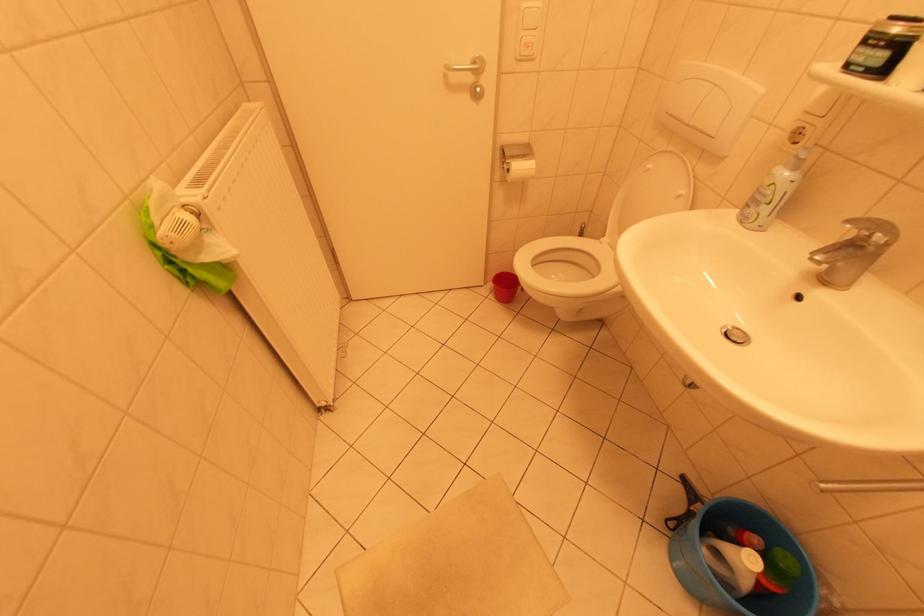
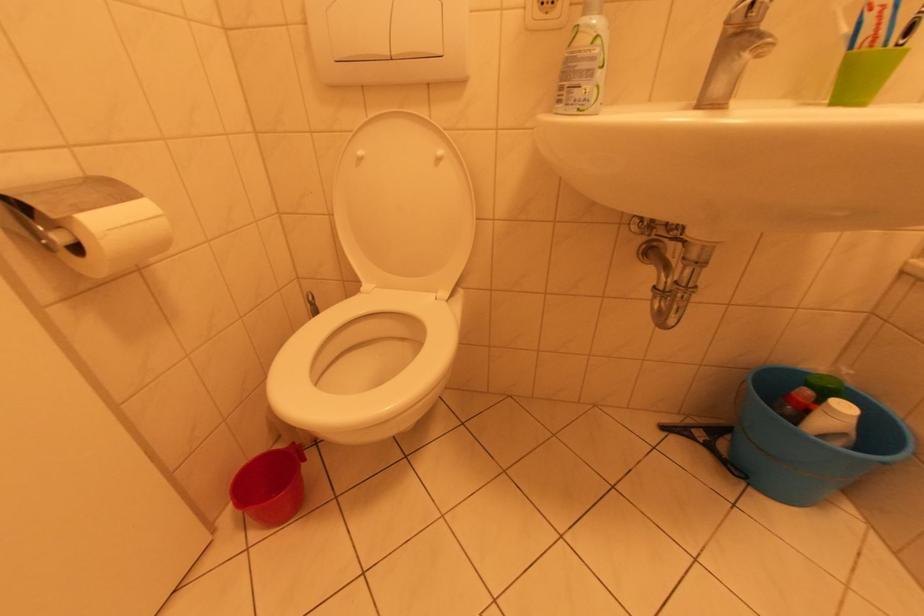
Question: Based on the continuous images, in which direction is the camera rotating? Reply with the corresponding letter.

Choices:
 (A) Left
 (B) Right
 (C) Up
 (D) Down

Answer: (B)